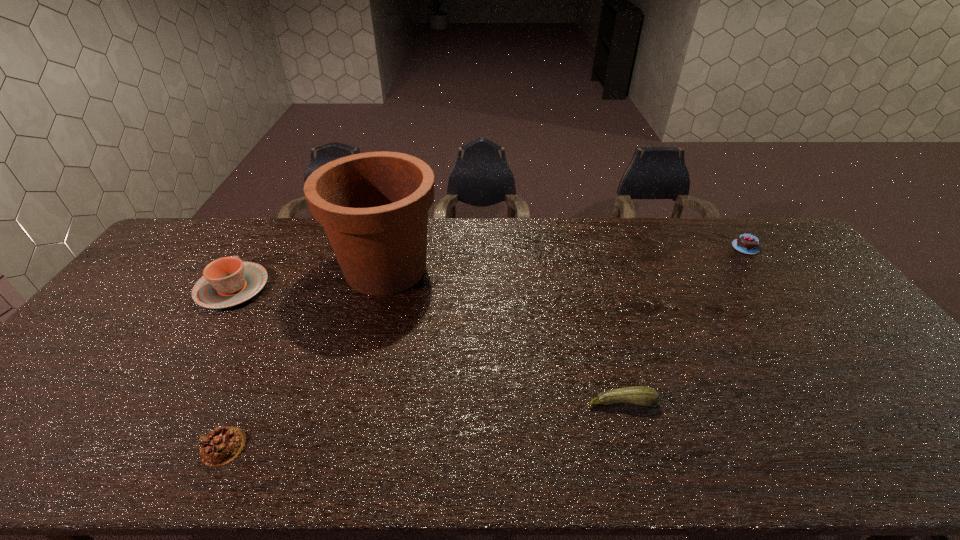
At what (x,y) coordinates should I click in order to perform the action: click on flowerpot. Please return your answer as a coordinate pair (x, y). The image size is (960, 540). Looking at the image, I should click on (373, 206).

Locate an element on the screen. the third object from left to right is located at coordinates (373, 206).

Locate an element on the screen. the fourth shortest object is located at coordinates (226, 282).

At what (x,y) coordinates should I click in order to perform the action: click on chinaware. Please return your answer as a coordinate pair (x, y). The height and width of the screenshot is (540, 960). Looking at the image, I should click on (226, 282).

The width and height of the screenshot is (960, 540). What are the coordinates of `the farther chocolate cake` in the screenshot? It's located at (746, 243).

Identify the location of the right chocolate cake. This screenshot has width=960, height=540. (746, 243).

Find the location of a particular element. This screenshot has width=960, height=540. the second object from right to left is located at coordinates (645, 396).

At what (x,y) coordinates should I click in order to perform the action: click on zucchini. Please return your answer as a coordinate pair (x, y). The width and height of the screenshot is (960, 540). Looking at the image, I should click on (645, 396).

Image resolution: width=960 pixels, height=540 pixels. I want to click on the left chocolate cake, so click(221, 446).

The image size is (960, 540). In order to click on the second object from left to right in this screenshot , I will do `click(221, 446)`.